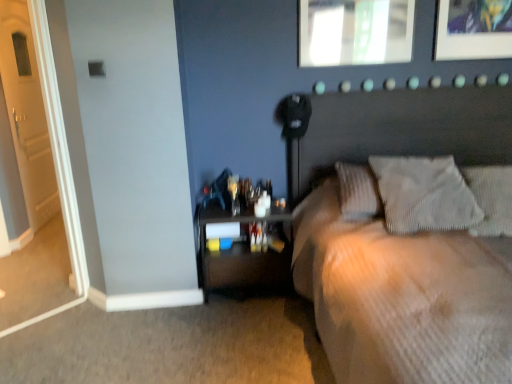
Question: Considering the relative positions of matte glass picture frame at upper center and beige textured bed at center in the image provided, is matte glass picture frame at upper center to the right of beige textured bed at center from the viewer's perspective?

Choices:
 (A) no
 (B) yes

Answer: (A)

Question: Does matte glass picture frame at upper center lie in front of beige textured bed at center?

Choices:
 (A) no
 (B) yes

Answer: (A)

Question: Is matte glass picture frame at upper center not within beige textured bed at center?

Choices:
 (A) yes
 (B) no

Answer: (A)

Question: Is matte glass picture frame at upper center beside beige textured bed at center?

Choices:
 (A) no
 (B) yes

Answer: (A)

Question: Could you tell me if matte glass picture frame at upper center is turned towards beige textured bed at center?

Choices:
 (A) no
 (B) yes

Answer: (A)

Question: Considering the relative sizes of matte glass picture frame at upper center and beige textured bed at center in the image provided, is matte glass picture frame at upper center smaller than beige textured bed at center?

Choices:
 (A) yes
 (B) no

Answer: (A)

Question: Can you confirm if textured gray pillow at upper right, the second pillow viewed from the left, is shorter than wooden nightstand at lower left?

Choices:
 (A) no
 (B) yes

Answer: (B)

Question: From the image's perspective, does textured gray pillow at upper right, the second pillow viewed from the left, appear higher than wooden nightstand at lower left?

Choices:
 (A) yes
 (B) no

Answer: (A)

Question: Is textured gray pillow at upper right, marked as the 1th pillow in a right-to-left arrangement, at the right side of wooden nightstand at lower left?

Choices:
 (A) no
 (B) yes

Answer: (B)

Question: Can you confirm if textured gray pillow at upper right, the second pillow viewed from the left, is smaller than wooden nightstand at lower left?

Choices:
 (A) yes
 (B) no

Answer: (A)

Question: Is textured gray pillow at upper right, the second pillow viewed from the left, taller than wooden nightstand at lower left?

Choices:
 (A) yes
 (B) no

Answer: (B)

Question: Is textured gray pillow at upper right, marked as the 1th pillow in a right-to-left arrangement, behind wooden nightstand at lower left?

Choices:
 (A) yes
 (B) no

Answer: (B)

Question: Is matte glass picture frame at upper center positioned far away from white wooden door at left?

Choices:
 (A) yes
 (B) no

Answer: (A)